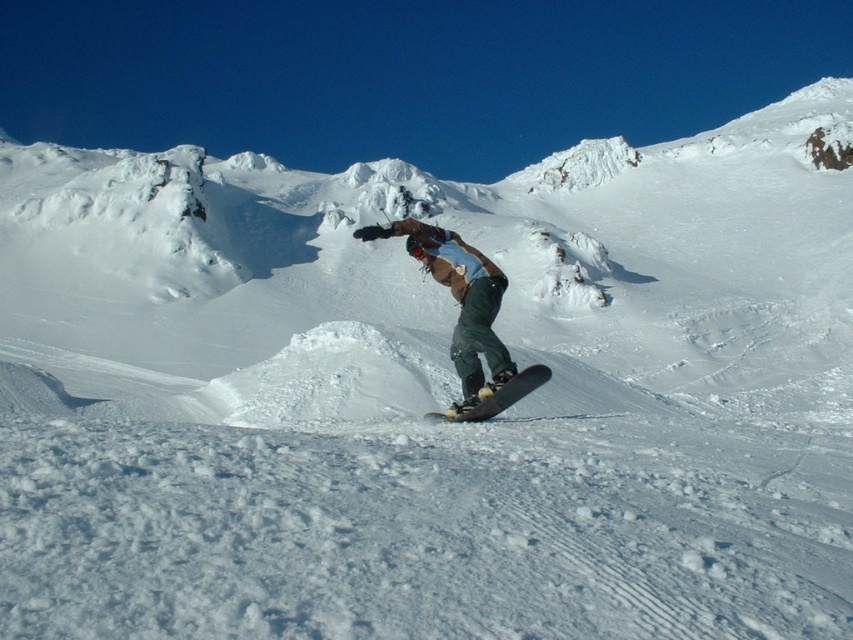
You are a photographer trying to capture the snowboarder in a photo. You notice the green fabric snowboarder at center and the black matte snowboard at center. Which object should you focus on if you want to capture the one closer to the left side of the photo?

The green fabric snowboarder at center is to the left of the black matte snowboard at center, so focusing on the green fabric snowboarder at center will capture the object closer to the left side of the photo.

You are analyzing the snowboarder image. There are two points marked in the scene, point 1 at coordinates point (489, 396) and point 2 at coordinates point (492, 397). Which point is closer to the camera?

Point (489, 396) is further to the camera than point (492, 397), so point 2 at coordinates point (492, 397) is closer to the camera.

You are a photographer positioned at the base of the mountain, aiming to capture the green fabric snowboarder at center performing their trick. Your camera has a maximum focus range of 20 meters. Will you be able to focus on the snowboarder from your current position?

The green fabric snowboarder at center is 23.54 meters away from the camera. Since the maximum focus range is 20 meters, the photographer will not be able to focus on the snowboarder from their current position.